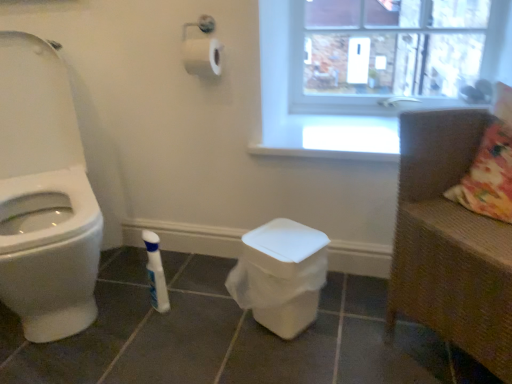
Question: Could you tell me if brown woven armchair at right is facing transparent plastic window screen at upper right?

Choices:
 (A) yes
 (B) no

Answer: (B)

Question: Can you confirm if brown woven armchair at right is taller than transparent plastic window screen at upper right?

Choices:
 (A) no
 (B) yes

Answer: (B)

Question: Is brown woven armchair at right next to transparent plastic window screen at upper right and touching it?

Choices:
 (A) yes
 (B) no

Answer: (B)

Question: Is brown woven armchair at right closer to the viewer compared to transparent plastic window screen at upper right?

Choices:
 (A) no
 (B) yes

Answer: (B)

Question: Is brown woven armchair at right to the left of transparent plastic window screen at upper right from the viewer's perspective?

Choices:
 (A) yes
 (B) no

Answer: (B)

Question: Is transparent plastic window screen at upper right wider or thinner than white glossy bottle at lower center?

Choices:
 (A) thin
 (B) wide

Answer: (A)

Question: Considering the positions of point (328, 87) and point (158, 289), is point (328, 87) closer or farther from the camera than point (158, 289)?

Choices:
 (A) closer
 (B) farther

Answer: (B)

Question: From a real-world perspective, is transparent plastic window screen at upper right physically located above or below white glossy bottle at lower center?

Choices:
 (A) above
 (B) below

Answer: (A)

Question: Considering the positions of transparent plastic window screen at upper right and white glossy bottle at lower center in the image, is transparent plastic window screen at upper right taller or shorter than white glossy bottle at lower center?

Choices:
 (A) tall
 (B) short

Answer: (A)

Question: Is point (428, 281) closer or farther from the camera than point (417, 13)?

Choices:
 (A) closer
 (B) farther

Answer: (A)

Question: From a real-world perspective, relative to transparent plastic window screen at upper right, is brown woven armchair at right vertically above or below?

Choices:
 (A) below
 (B) above

Answer: (A)

Question: Which is correct: brown woven armchair at right is inside transparent plastic window screen at upper right, or outside of it?

Choices:
 (A) outside
 (B) inside

Answer: (A)

Question: Looking at the image, does brown woven armchair at right seem bigger or smaller compared to transparent plastic window screen at upper right?

Choices:
 (A) big
 (B) small

Answer: (A)

Question: From a real-world perspective, is brown woven armchair at right above or below white glossy bottle at lower center?

Choices:
 (A) above
 (B) below

Answer: (A)

Question: In terms of width, does brown woven armchair at right look wider or thinner when compared to white glossy bottle at lower center?

Choices:
 (A) wide
 (B) thin

Answer: (A)